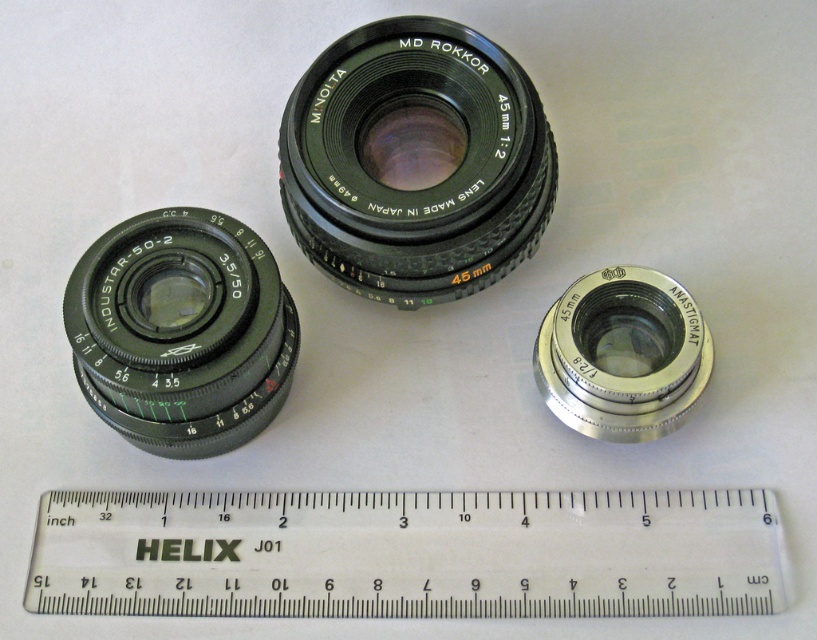
Question: Observing the image, what is the correct spatial positioning of white plastic ruler at bottom in reference to matte black lens at lower left?

Choices:
 (A) right
 (B) left

Answer: (A)

Question: Which point is farther from the camera taking this photo?

Choices:
 (A) (300, 524)
 (B) (137, 422)
 (C) (471, 166)

Answer: (A)

Question: Which is nearer to the silver metallic anastigmat at center?

Choices:
 (A) matte black lens at lower left
 (B) black plastic lens at upper center
 (C) white plastic ruler at bottom

Answer: (C)

Question: Among these objects, which one is nearest to the camera?

Choices:
 (A) silver metallic anastigmat at center
 (B) white plastic ruler at bottom
 (C) black plastic lens at upper center
 (D) matte black lens at lower left

Answer: (D)

Question: Is matte black lens at lower left to the right of silver metallic anastigmat at center from the viewer's perspective?

Choices:
 (A) no
 (B) yes

Answer: (A)

Question: Can you confirm if white plastic ruler at bottom is smaller than silver metallic anastigmat at center?

Choices:
 (A) no
 (B) yes

Answer: (A)